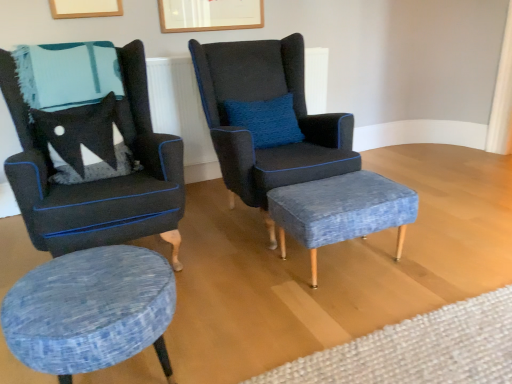
Locate an element on the screen. empty space that is ontop of textured blue fabric stool at lower left, the second stool viewed from the right (from a real-world perspective) is located at coordinates coord(79,283).